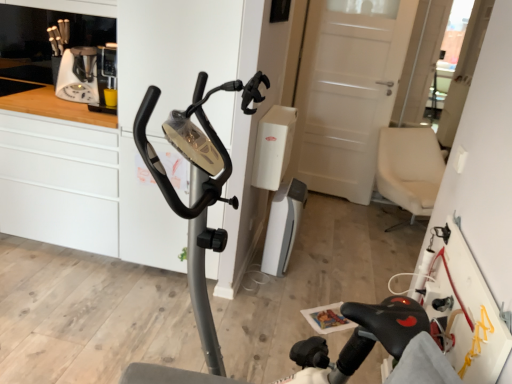
Where is `spots to the right of white glossy dresser at center`? This screenshot has height=384, width=512. spots to the right of white glossy dresser at center is located at coordinates (303, 275).